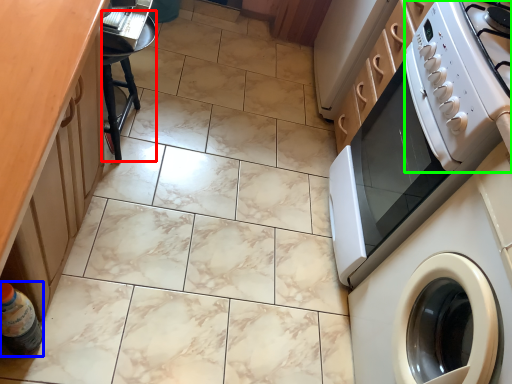
Question: Which is nearer to the bar stool (highlighted by a red box)? bottle (highlighted by a blue box) or appliance (highlighted by a green box).

Choices:
 (A) bottle
 (B) appliance

Answer: (A)